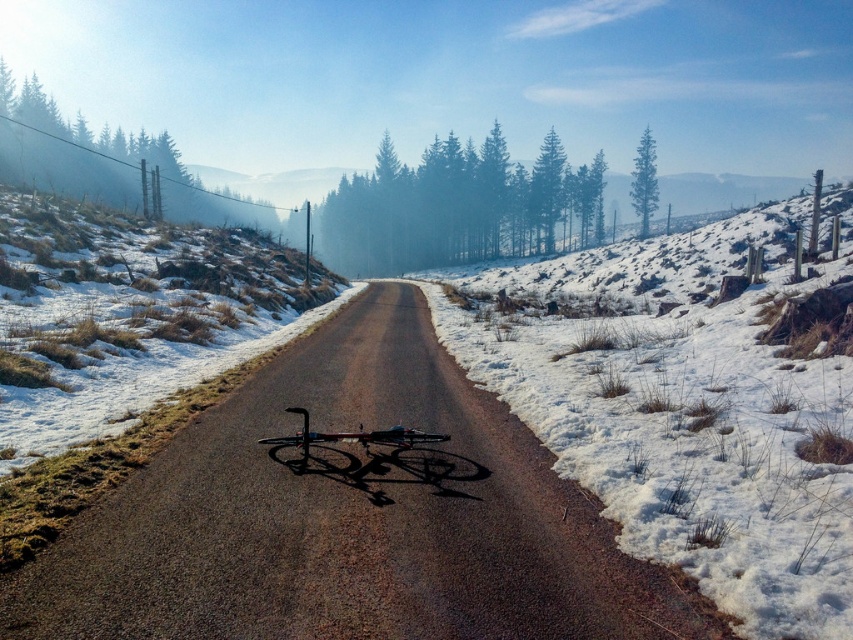
Is the position of white fluffy snow at right less distant than that of shiny metallic bicycle at center?

Yes.

Is white fluffy snow at right wider than shiny metallic bicycle at center?

Yes.

Does point (727, 436) lie behind point (305, 444)?

Yes, it is behind point (305, 444).

Identify the location of white fluffy snow at right. The width and height of the screenshot is (853, 640). (689, 403).

Who is lower down, dirt/gravel road at center or white fluffy snow at right?

dirt/gravel road at center is lower down.

Who is taller, dirt/gravel road at center or white fluffy snow at right?

With more height is white fluffy snow at right.

Is point (457, 524) positioned in front of point (729, 316)?

That is True.

In order to click on dirt/gravel road at center in this screenshot , I will do `click(350, 516)`.

Between dirt/gravel road at center and shiny metallic bicycle at center, which one has more height?

With more height is dirt/gravel road at center.

Does dirt/gravel road at center have a greater height compared to shiny metallic bicycle at center?

Yes, dirt/gravel road at center is taller than shiny metallic bicycle at center.

The height and width of the screenshot is (640, 853). What do you see at coordinates (350, 516) in the screenshot?
I see `dirt/gravel road at center` at bounding box center [350, 516].

This screenshot has height=640, width=853. What are the coordinates of `dirt/gravel road at center` in the screenshot? It's located at (350, 516).